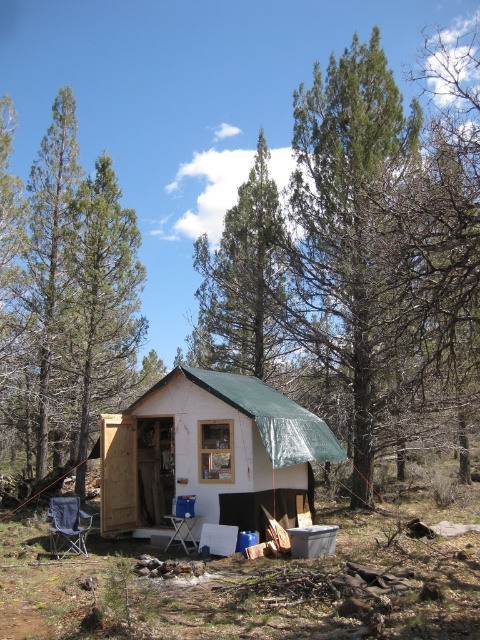
Between green leafy tree at center and blue fabric folding chair at lower left, which one has less height?

With less height is blue fabric folding chair at lower left.

Which of these two, green leafy tree at center or blue fabric folding chair at lower left, stands taller?

With more height is green leafy tree at center.

The image size is (480, 640). In order to click on green leafy tree at center in this screenshot , I will do `click(360, 257)`.

This screenshot has width=480, height=640. I want to click on green leafy tree at center, so click(x=360, y=257).

What do you see at coordinates (360, 257) in the screenshot?
I see `green leafy tree at center` at bounding box center [360, 257].

Can you confirm if green leafy tree at center is positioned below green coniferous tree at center?

No.

Between point (204, 340) and point (200, 364), which one is positioned behind?

The point (200, 364) is more distant.

Locate an element on the screen. The width and height of the screenshot is (480, 640). green leafy tree at center is located at coordinates (360, 257).

Is point (211, 284) positioned in front of point (86, 528)?

No, (211, 284) is further to viewer.

What do you see at coordinates (243, 282) in the screenshot? I see `green coniferous tree at center` at bounding box center [243, 282].

This screenshot has height=640, width=480. Find the location of `green coniferous tree at center`. green coniferous tree at center is located at coordinates (243, 282).